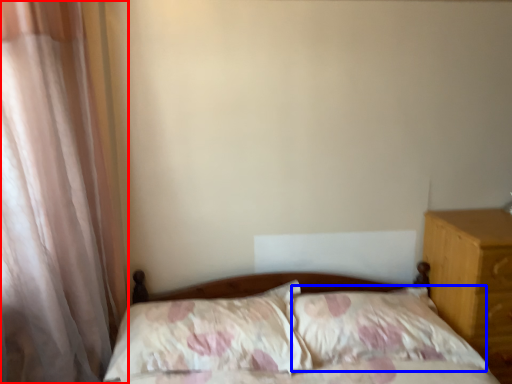
Question: Among these objects, which one is farthest to the camera, curtain (highlighted by a red box) or pillow (highlighted by a blue box)?

Choices:
 (A) curtain
 (B) pillow

Answer: (B)